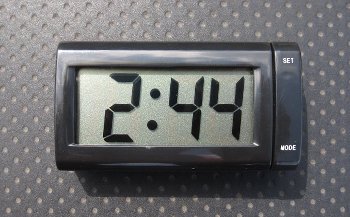
Identify the location of alarm clock. The image size is (350, 217). (173, 132).